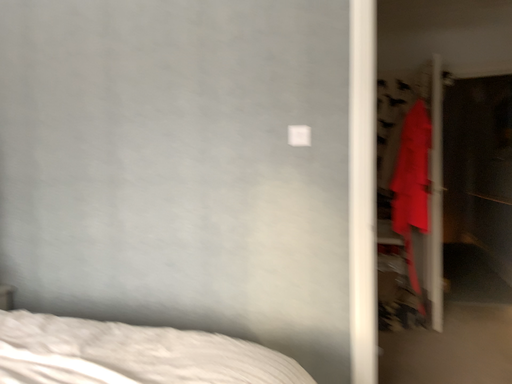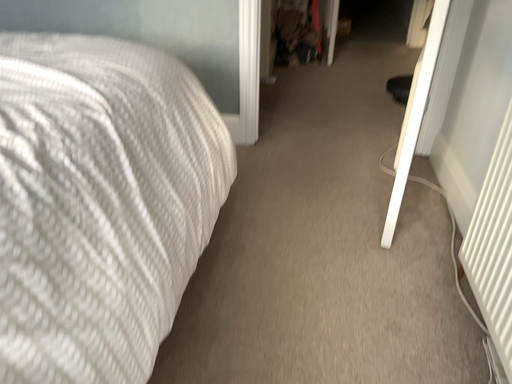
Question: Which way did the camera rotate in the video?

Choices:
 (A) rotated right
 (B) rotated left

Answer: (A)